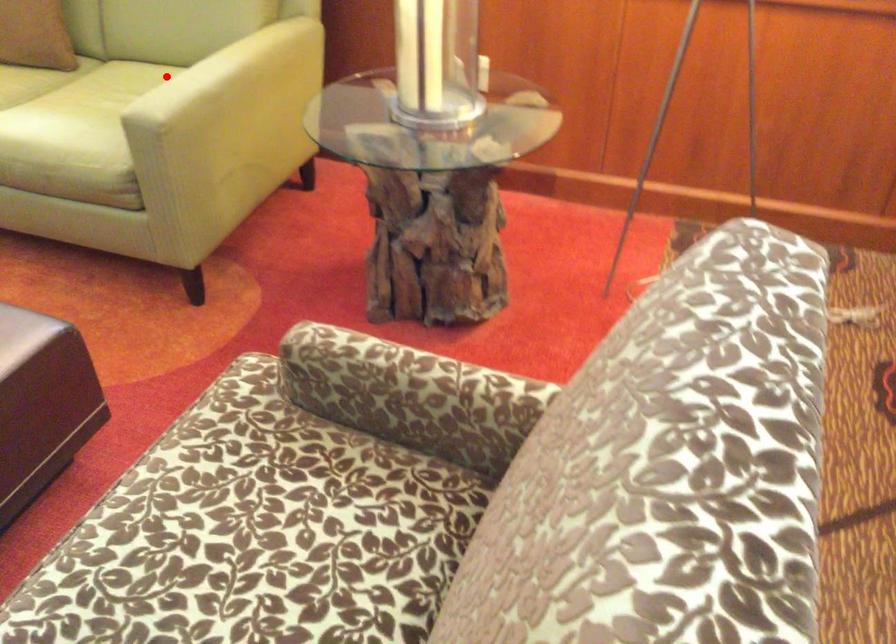
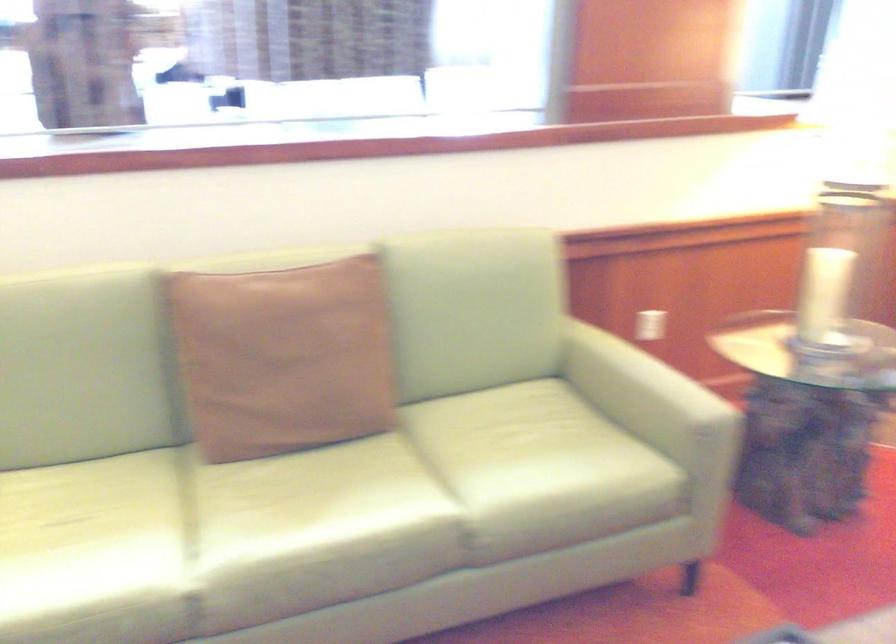
The point at the highlighted location is marked in the first image. Where is the corresponding point in the second image?

(640, 386)